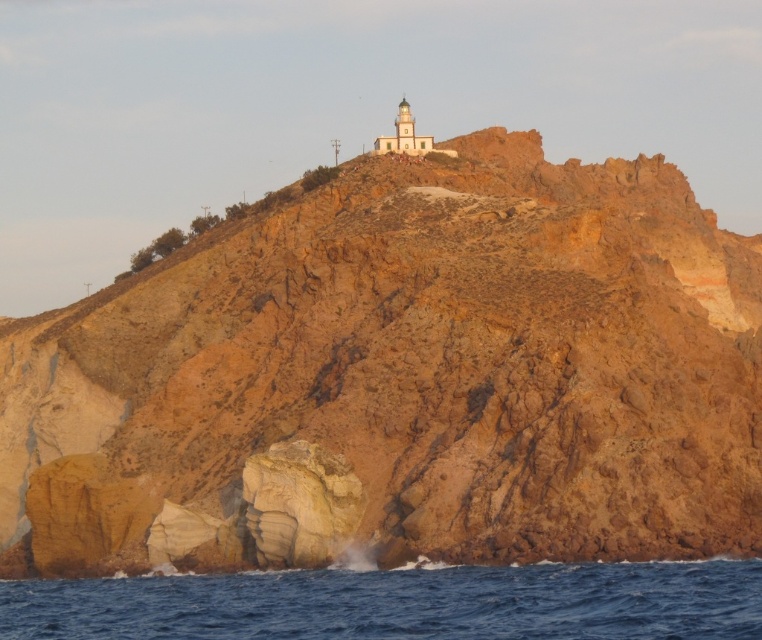
Is rustic rock cliff at upper center smaller than blue water at lower center?

No, rustic rock cliff at upper center is not smaller than blue water at lower center.

Is the position of rustic rock cliff at upper center less distant than that of blue water at lower center?

No, rustic rock cliff at upper center is behind blue water at lower center.

The height and width of the screenshot is (640, 762). What do you see at coordinates (402, 378) in the screenshot?
I see `rustic rock cliff at upper center` at bounding box center [402, 378].

Where is `rustic rock cliff at upper center`? rustic rock cliff at upper center is located at coordinates (402, 378).